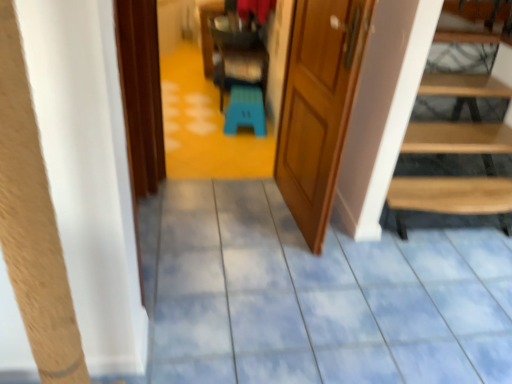
Question: Is blue plastic stool at center further to the viewer compared to wooden door at center?

Choices:
 (A) no
 (B) yes

Answer: (B)

Question: From the image's perspective, is blue plastic stool at center under wooden door at center?

Choices:
 (A) no
 (B) yes

Answer: (A)

Question: From a real-world perspective, is blue plastic stool at center positioned under wooden door at center based on gravity?

Choices:
 (A) no
 (B) yes

Answer: (B)

Question: Considering the relative sizes of blue plastic stool at center and wooden door at center in the image provided, is blue plastic stool at center wider than wooden door at center?

Choices:
 (A) no
 (B) yes

Answer: (B)

Question: Considering the relative sizes of blue plastic stool at center and wooden door at center in the image provided, is blue plastic stool at center bigger than wooden door at center?

Choices:
 (A) no
 (B) yes

Answer: (A)

Question: Is blue plastic stool at center oriented away from wooden door at center?

Choices:
 (A) yes
 (B) no

Answer: (B)

Question: Is the depth of blue plastic stool at center less than that of blue glossy tile floor at center?

Choices:
 (A) yes
 (B) no

Answer: (B)

Question: Considering the relative sizes of blue plastic stool at center and blue glossy tile floor at center in the image provided, is blue plastic stool at center bigger than blue glossy tile floor at center?

Choices:
 (A) yes
 (B) no

Answer: (B)

Question: From the image's perspective, is blue plastic stool at center beneath blue glossy tile floor at center?

Choices:
 (A) yes
 (B) no

Answer: (B)

Question: Is blue plastic stool at center outside of blue glossy tile floor at center?

Choices:
 (A) yes
 (B) no

Answer: (A)

Question: Is blue plastic stool at center positioned far away from blue glossy tile floor at center?

Choices:
 (A) yes
 (B) no

Answer: (A)

Question: Is blue plastic stool at center positioned with its back to blue glossy tile floor at center?

Choices:
 (A) no
 (B) yes

Answer: (A)

Question: Can we say blue glossy tile floor at center lies outside wooden door at center?

Choices:
 (A) yes
 (B) no

Answer: (A)